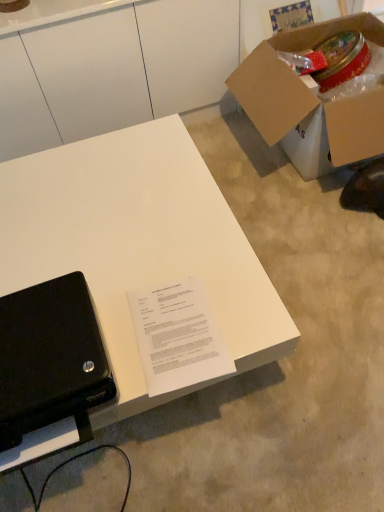
Question: Is cardboard box at upper right situated inside black matte laptop at lower left or outside?

Choices:
 (A) inside
 (B) outside

Answer: (B)

Question: Is cardboard box at upper right in front of or behind black matte laptop at lower left in the image?

Choices:
 (A) front
 (B) behind

Answer: (B)

Question: Which object is the farthest from the black matte laptop at lower left?

Choices:
 (A) white paper at center
 (B) white matte desk at lower left
 (C) cardboard box at upper right

Answer: (C)

Question: Which is farther from the white paper at center?

Choices:
 (A) black matte laptop at lower left
 (B) white matte desk at lower left
 (C) cardboard box at upper right

Answer: (C)